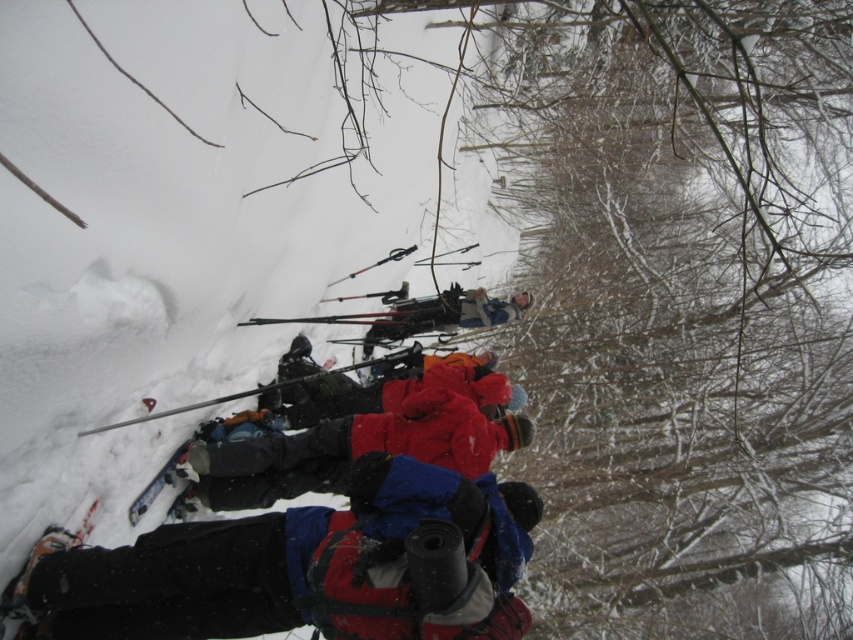
Does red synthetic jacket at center appear over red fuzzy jacket at center?

Actually, red synthetic jacket at center is below red fuzzy jacket at center.

Does red synthetic jacket at center appear on the right side of red fuzzy jacket at center?

Incorrect, red synthetic jacket at center is not on the right side of red fuzzy jacket at center.

Is point (375, 570) behind point (396, 381)?

No, it is not.

Image resolution: width=853 pixels, height=640 pixels. What are the coordinates of `red synthetic jacket at center` in the screenshot? It's located at (308, 566).

Does point (422, 355) come farther from viewer compared to point (24, 627)?

Yes, it is behind point (24, 627).

You are a GUI agent. You are given a task and a screenshot of the screen. Output one action in this format:
    pyautogui.click(x=<x>, y=<y>)
    Task: Click on the red fuzzy jacket at center
    Image resolution: width=853 pixels, height=640 pixels.
    Given the screenshot: What is the action you would take?
    pyautogui.click(x=409, y=390)

This screenshot has height=640, width=853. What are the coordinates of `red fuzzy jacket at center` in the screenshot? It's located at (409, 390).

Is red synthetic jacket at center closer to the viewer compared to red fabric jacket at center?

That is True.

Does red synthetic jacket at center have a lesser height compared to red fabric jacket at center?

Incorrect, red synthetic jacket at center's height does not fall short of red fabric jacket at center's.

This screenshot has height=640, width=853. I want to click on red synthetic jacket at center, so tap(308, 566).

This screenshot has width=853, height=640. What are the coordinates of `red synthetic jacket at center` in the screenshot? It's located at (308, 566).